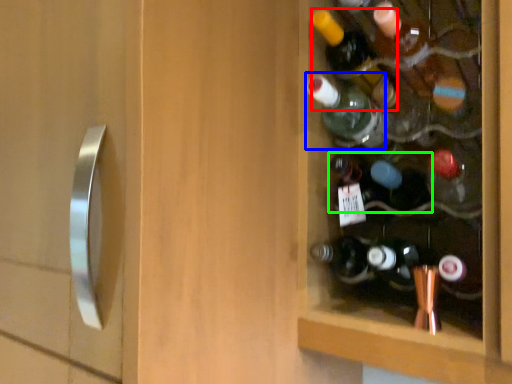
Question: Considering the real-world distances, which object is farthest from bottle (highlighted by a red box)? bottle (highlighted by a blue box) or bottle (highlighted by a green box)?

Choices:
 (A) bottle
 (B) bottle

Answer: (B)